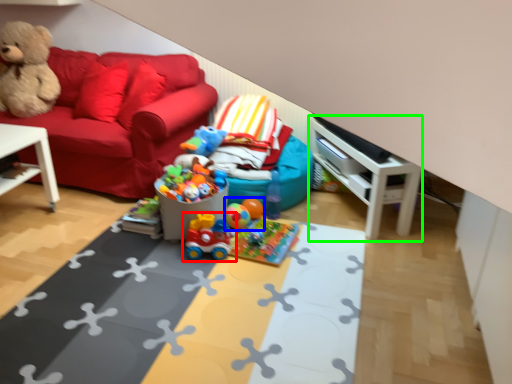
Question: Considering the real-world distances, which object is farthest from toy (highlighted by a red box)? toy (highlighted by a blue box) or entertainment center (highlighted by a green box)?

Choices:
 (A) toy
 (B) entertainment center

Answer: (B)